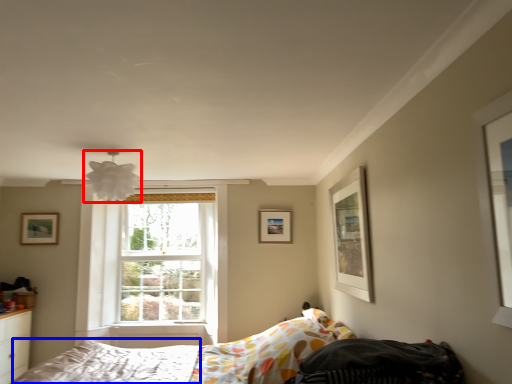
Question: Which of the following is the closest to the observer, lamp (highlighted by a red box) or mattress (highlighted by a blue box)?

Choices:
 (A) lamp
 (B) mattress

Answer: (B)